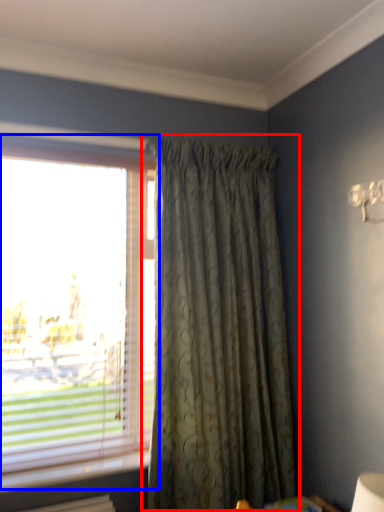
Question: Which point is closer to the camera, curtain (highlighted by a red box) or window (highlighted by a blue box)?

Choices:
 (A) curtain
 (B) window

Answer: (A)